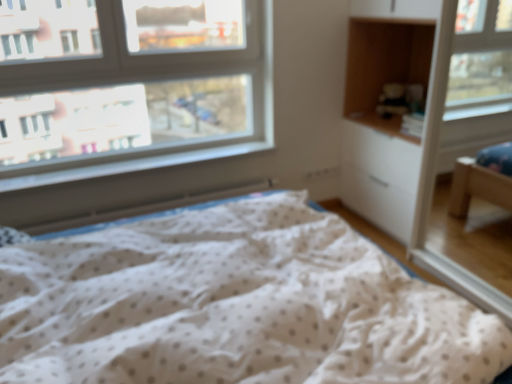
Question: Is clear glass window at upper left facing away from white dotted fabric at center?

Choices:
 (A) yes
 (B) no

Answer: (B)

Question: Is clear glass window at upper left shorter than white dotted fabric at center?

Choices:
 (A) yes
 (B) no

Answer: (B)

Question: From the image's perspective, does clear glass window at upper left appear lower than white dotted fabric at center?

Choices:
 (A) no
 (B) yes

Answer: (A)

Question: Does clear glass window at upper left turn towards white dotted fabric at center?

Choices:
 (A) no
 (B) yes

Answer: (B)

Question: Does clear glass window at upper left contain white dotted fabric at center?

Choices:
 (A) yes
 (B) no

Answer: (B)

Question: From their relative heights in the image, would you say wooden cabinet at upper right is taller or shorter than white dotted fabric at center?

Choices:
 (A) short
 (B) tall

Answer: (B)

Question: From the image's perspective, is wooden cabinet at upper right located above or below white dotted fabric at center?

Choices:
 (A) below
 (B) above

Answer: (B)

Question: From a real-world perspective, relative to white dotted fabric at center, is wooden cabinet at upper right vertically above or below?

Choices:
 (A) below
 (B) above

Answer: (B)

Question: Considering the relative positions of wooden cabinet at upper right and white dotted fabric at center in the image provided, is wooden cabinet at upper right to the left or to the right of white dotted fabric at center?

Choices:
 (A) right
 (B) left

Answer: (A)

Question: Would you say clear glass window at upper left is to the left or to the right of wooden cabinet at upper right in the picture?

Choices:
 (A) left
 (B) right

Answer: (A)

Question: Is clear glass window at upper left bigger or smaller than wooden cabinet at upper right?

Choices:
 (A) big
 (B) small

Answer: (B)

Question: Considering the positions of point (150, 135) and point (369, 61), is point (150, 135) closer or farther from the camera than point (369, 61)?

Choices:
 (A) farther
 (B) closer

Answer: (A)

Question: In the image, is clear glass window at upper left positioned in front of or behind wooden cabinet at upper right?

Choices:
 (A) front
 (B) behind

Answer: (A)

Question: Is white plastic window sill at lower left inside the boundaries of clear glass window at upper left, or outside?

Choices:
 (A) inside
 (B) outside

Answer: (B)

Question: Is point (11, 178) positioned closer to the camera than point (268, 48)?

Choices:
 (A) closer
 (B) farther

Answer: (A)